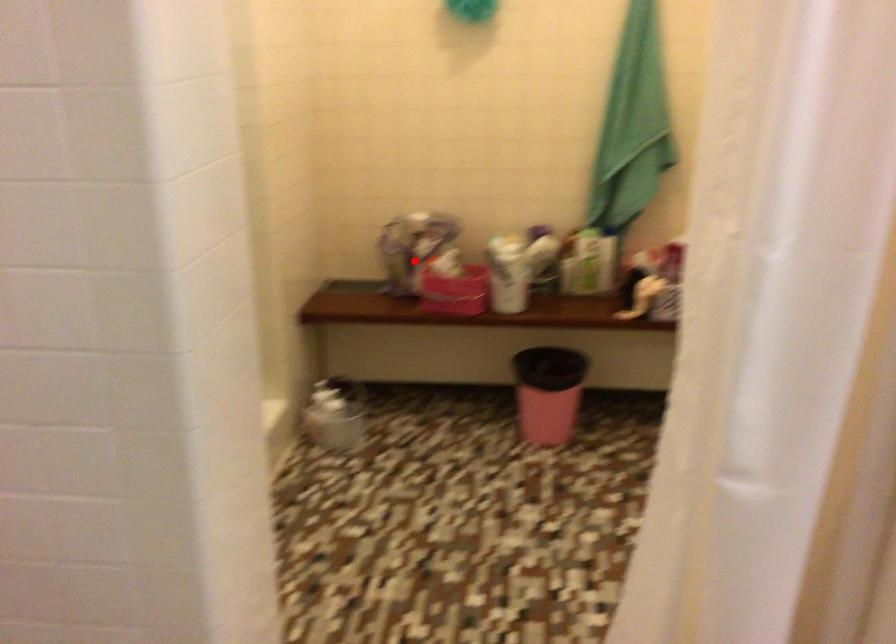
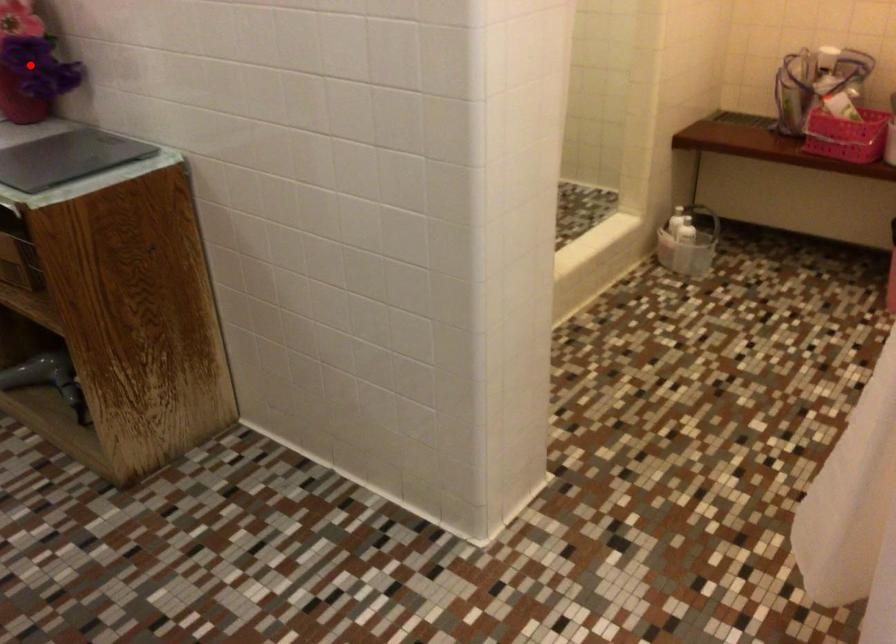
I am providing you with two images of the same scene from different viewpoints. A red point is marked on the first image and another point is marked on the second image. Does the point marked in image1 correspond to the same location as the one in image2?

No